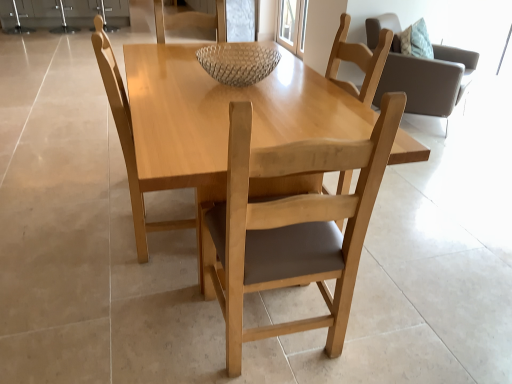
Question: Does transparent glass door at upper center have a greater height compared to light brown wood chair at upper right, the third chair viewed from the left?

Choices:
 (A) no
 (B) yes

Answer: (A)

Question: Is transparent glass door at upper center behind light brown wood chair at upper right, which is the 1th chair from right to left?

Choices:
 (A) no
 (B) yes

Answer: (B)

Question: From a real-world perspective, is transparent glass door at upper center positioned over light brown wood chair at upper right, which is the third chair in front-to-back order, based on gravity?

Choices:
 (A) yes
 (B) no

Answer: (B)

Question: Is transparent glass door at upper center facing away from light brown wood chair at upper right, which is the third chair in front-to-back order?

Choices:
 (A) no
 (B) yes

Answer: (A)

Question: Considering the relative sizes of transparent glass door at upper center and light brown wood chair at upper right, which is the third chair in front-to-back order, in the image provided, is transparent glass door at upper center wider than light brown wood chair at upper right, which is the third chair in front-to-back order,?

Choices:
 (A) yes
 (B) no

Answer: (B)

Question: Is light brown wood chair at upper right, which ranks as the first chair in back-to-front order, a part of transparent glass door at upper center?

Choices:
 (A) yes
 (B) no

Answer: (B)

Question: Does light wood table at center have a greater height compared to light wood chair at center, which is the 2th chair in back-to-front order?

Choices:
 (A) yes
 (B) no

Answer: (B)

Question: Is light wood table at center smaller than light wood chair at center, marked as the 1th chair in a left-to-right arrangement?

Choices:
 (A) yes
 (B) no

Answer: (B)

Question: Is light wood table at center facing away from light wood chair at center, the second chair from the front?

Choices:
 (A) no
 (B) yes

Answer: (B)

Question: From the image's perspective, would you say light wood table at center is shown under light wood chair at center, marked as the 1th chair in a left-to-right arrangement?

Choices:
 (A) yes
 (B) no

Answer: (A)

Question: From a real-world perspective, is light wood table at center physically above light wood chair at center, the second chair from the front?

Choices:
 (A) no
 (B) yes

Answer: (A)

Question: Is light wood table at center thinner than light wood chair at center, the second chair from the front?

Choices:
 (A) yes
 (B) no

Answer: (B)

Question: Is light wood chair at center, which is the second chair in right-to-left order, located within transparent glass door at upper center?

Choices:
 (A) no
 (B) yes

Answer: (A)